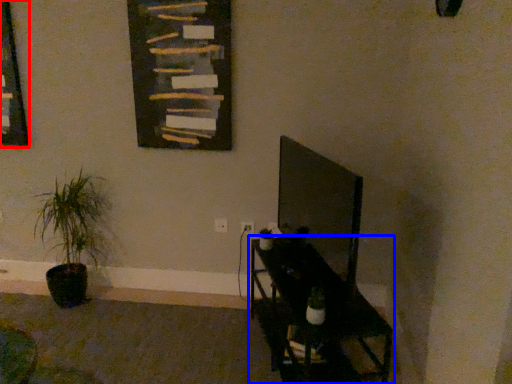
Question: Which object appears closest to the camera in this image, picture frame (highlighted by a red box) or furniture (highlighted by a blue box)?

Choices:
 (A) picture frame
 (B) furniture

Answer: (B)